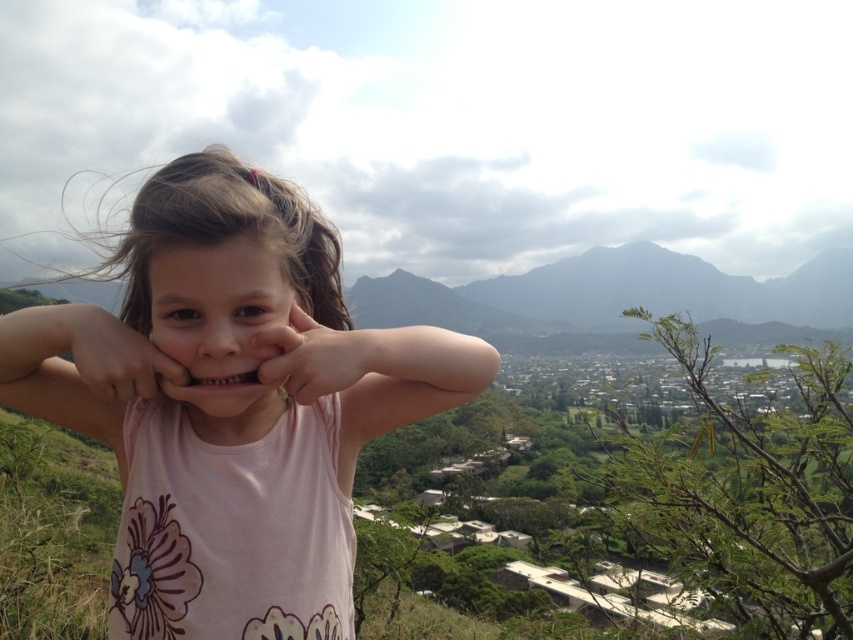
Is matte pink shirt at center in front of pink fabric hand at center?

Yes, it is in front of pink fabric hand at center.

Between matte pink shirt at center and pink fabric hand at center, which one is positioned higher?

Answer: Positioned higher is pink fabric hand at center.

What do you see at coordinates (78, 368) in the screenshot?
I see `matte pink shirt at center` at bounding box center [78, 368].

At what (x,y) coordinates should I click in order to perform the action: click on matte pink shirt at center. Please return your answer as a coordinate pair (x, y). Image resolution: width=853 pixels, height=640 pixels. Looking at the image, I should click on (78, 368).

Can you confirm if smooth skin face at center is positioned to the right of matte pink shirt at center?

Yes, smooth skin face at center is to the right of matte pink shirt at center.

Which of these two, smooth skin face at center or matte pink shirt at center, stands shorter?

smooth skin face at center

Image resolution: width=853 pixels, height=640 pixels. What do you see at coordinates (221, 326) in the screenshot? I see `smooth skin face at center` at bounding box center [221, 326].

Locate an element on the screen. smooth skin face at center is located at coordinates [x=221, y=326].

From the picture: Which is more to the right, pink fabric shirt at center or matte skin hand at center?

pink fabric shirt at center is more to the right.

Is point (329, 561) less distant than point (73, 317)?

No, (329, 561) is further to viewer.

Where is `pink fabric shirt at center`? Image resolution: width=853 pixels, height=640 pixels. pink fabric shirt at center is located at coordinates (233, 410).